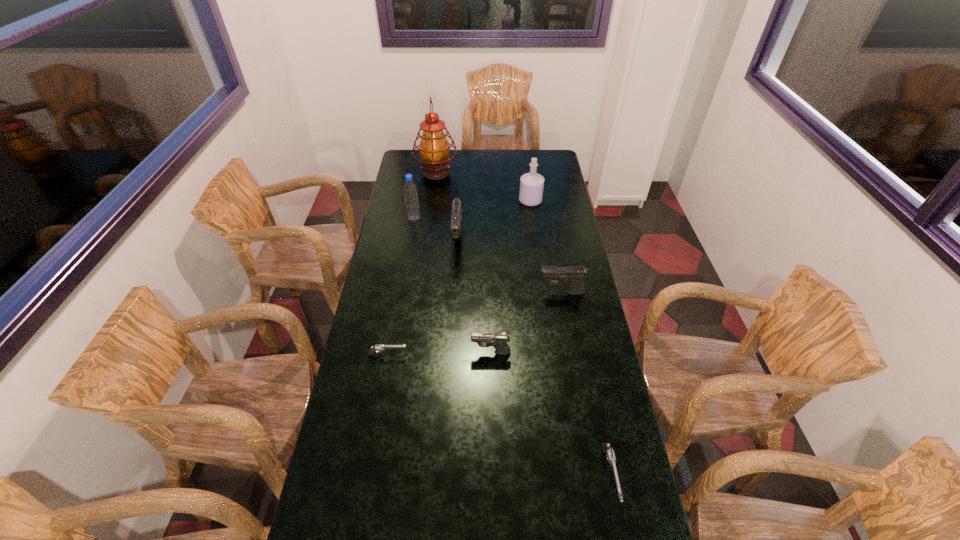
You are a GUI agent. You are given a task and a screenshot of the screen. Output one action in this format:
    pyautogui.click(x=<x>, y=<y>)
    Task: Click on the vacant area that lies between the fifth shortest object and the fourth shortest pistol
    This screenshot has height=540, width=960.
    Given the screenshot: What is the action you would take?
    pyautogui.click(x=510, y=267)

The width and height of the screenshot is (960, 540). I want to click on object that is the closest to the nearest black pistol, so click(x=373, y=349).

The image size is (960, 540). What are the coordinates of `object that is the fifth closest to the second black pistol from left to right` in the screenshot? It's located at (410, 189).

Point out which pistol is positioned as the second nearest to the smallest black pistol. Please provide its 2D coordinates. Your answer should be formatted as a tuple, i.e. [(x, y)], where the tuple contains the x and y coordinates of a point satisfying the conditions above.

[(572, 276)]

Point out which pistol is positioned as the nearest to the water bottle. Please provide its 2D coordinates. Your answer should be formatted as a tuple, i.e. [(x, y)], where the tuple contains the x and y coordinates of a point satisfying the conditions above.

[(456, 219)]

In order to click on black pistol that is the second closest to the perfume in this screenshot , I will do `click(572, 276)`.

Point out which black pistol is positioned as the nearest to the purple perfume. Please provide its 2D coordinates. Your answer should be formatted as a tuple, i.e. [(x, y)], where the tuple contains the x and y coordinates of a point satisfying the conditions above.

[(456, 219)]

Identify the location of vacant space that satisfies the following two spatial constraints: 1. on the front side of the oil lamp; 2. on the right side of the seventh nearest object. The width and height of the screenshot is (960, 540). (432, 201).